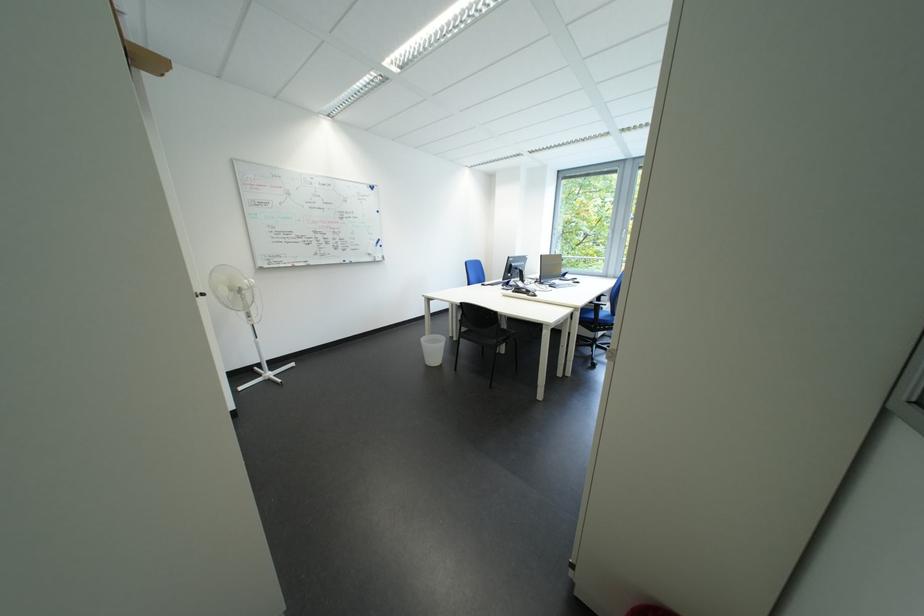
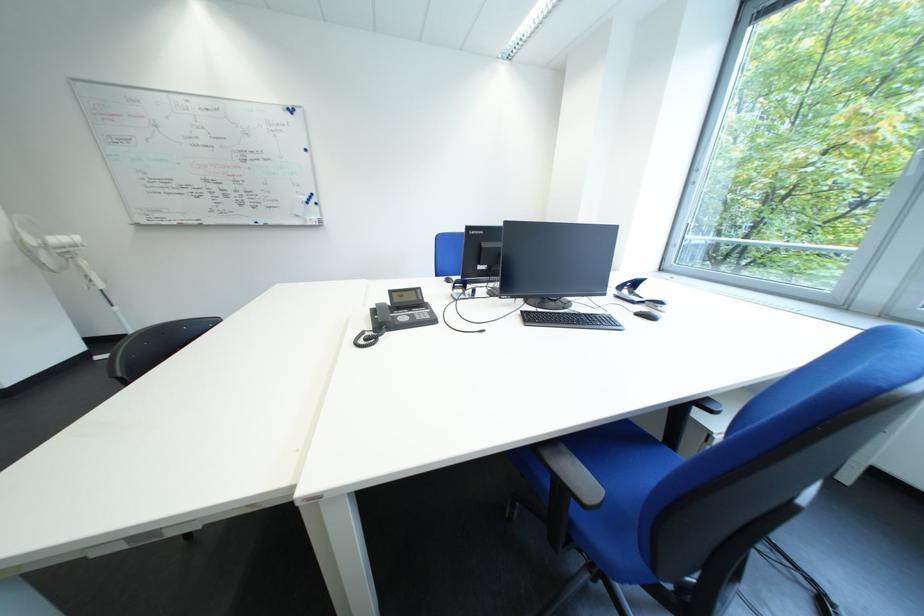
Locate, in the second image, the point that corresponds to point 278,269 in the first image.

(157, 225)